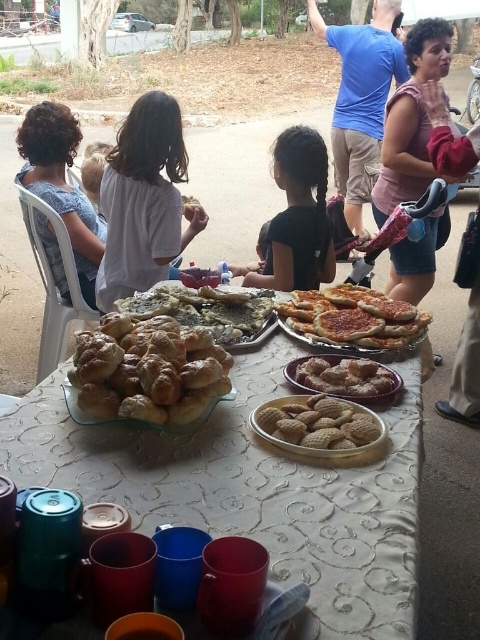
Between point (122, 497) and point (333, 433), which one is positioned in front?

Point (122, 497)

Is matte glass tray at center shorter than golden brown crumbly cookies at center?

In fact, matte glass tray at center may be taller than golden brown crumbly cookies at center.

At what (x,y) coordinates should I click in order to perform the action: click on matte glass tray at center. Please return your answer as a coordinate pair (x, y). Looking at the image, I should click on (252, 490).

Is black matte shirt at center smaller than golden brown crumbly pastry at center?

No.

Between point (305, 224) and point (375, 372), which one is positioned in front?

Point (375, 372)

Locate an element on the screen. The width and height of the screenshot is (480, 640). black matte shirt at center is located at coordinates (298, 216).

Can you confirm if golden crispy pizza at center is positioned to the right of golden brown crumbly pastry at center?

Yes, golden crispy pizza at center is to the right of golden brown crumbly pastry at center.

Is golden crispy pizza at center shorter than golden brown crumbly pastry at center?

Incorrect, golden crispy pizza at center's height does not fall short of golden brown crumbly pastry at center's.

Is point (326, 301) behind point (312, 380)?

Yes, it is behind point (312, 380).

Image resolution: width=480 pixels, height=640 pixels. I want to click on golden crispy pizza at center, so click(x=350, y=317).